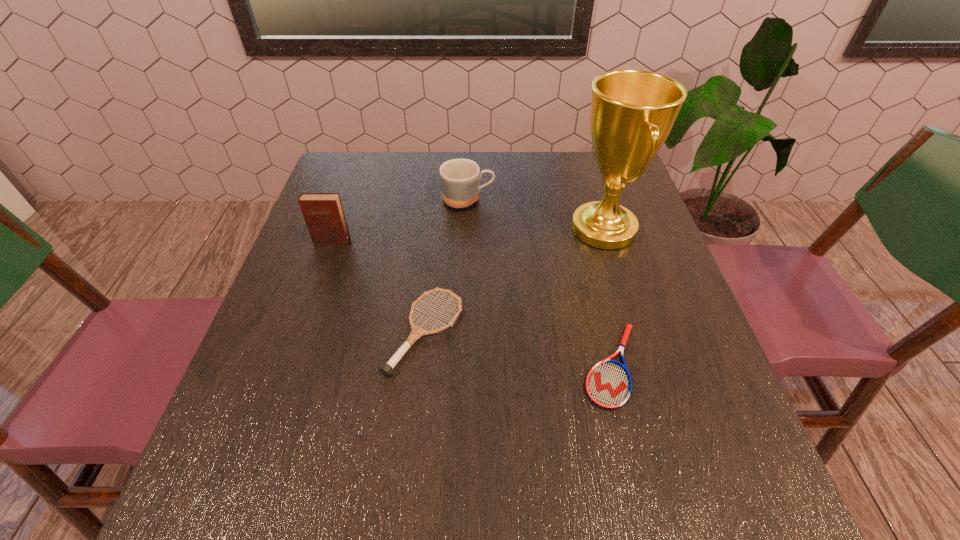
Locate an element on the screen. vacant space that's between the shortest object and the award is located at coordinates (608, 297).

Identify the location of vacant area between the tallest object and the fourth shortest object. (468, 235).

This screenshot has width=960, height=540. I want to click on free space between the diary and the award, so click(468, 235).

This screenshot has height=540, width=960. I want to click on free space that is in between the left tennis racket and the right tennis racket, so click(518, 349).

Locate an element on the screen. unoccupied position between the mug and the award is located at coordinates (536, 214).

I want to click on free space between the mug and the right tennis racket, so click(x=540, y=283).

Identify the location of vacant space that's between the mug and the right tennis racket. (540, 283).

Where is `free area in between the left tennis racket and the mug`? The width and height of the screenshot is (960, 540). free area in between the left tennis racket and the mug is located at coordinates (446, 266).

Locate which object is the second closest to the fourth tallest object. Please provide its 2D coordinates. Your answer should be formatted as a tuple, i.e. [(x, y)], where the tuple contains the x and y coordinates of a point satisfying the conditions above.

[(608, 385)]

Identify which object is located as the fourth nearest to the fourth tallest object. Please provide its 2D coordinates. Your answer should be formatted as a tuple, i.e. [(x, y)], where the tuple contains the x and y coordinates of a point satisfying the conditions above.

[(459, 178)]